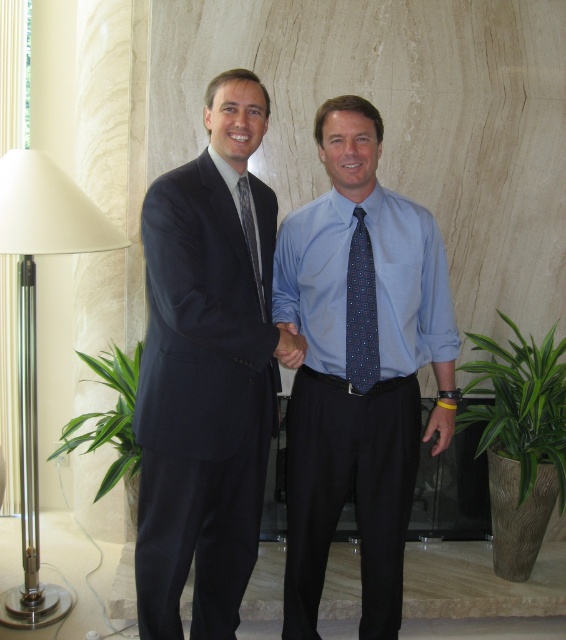
You are a photographer adjusting the camera focus. The blue silk shirt at center and the blue dotted tie at center are both in the frame. Which one should you focus on first if you want to ensure the wider object is sharp?

The blue silk shirt at center might be wider than blue dotted tie at center, so you should focus on the blue silk shirt at center first to ensure it is sharp.

You are a photographer setting up for a formal event. You notice the white glossy floor lamp at left and the blue dotted tie at center. Which object is located to the left of the other?

The white glossy floor lamp at left is positioned on the left side of the blue dotted tie at center, so the floor lamp is to the left of the tie.

You are standing in the room where the two men are shaking hands. You need to locate the white glossy floor lamp at left. Based on its 2D coordinates, where would you find it relative to the center of the room?

The white glossy floor lamp at left is located at coordinates approximately 52.7 percent along the horizontal axis and 6.2 percent along the vertical axis from the bottom left corner of the room, placing it slightly to the left and lower portion of the room relative to the center.